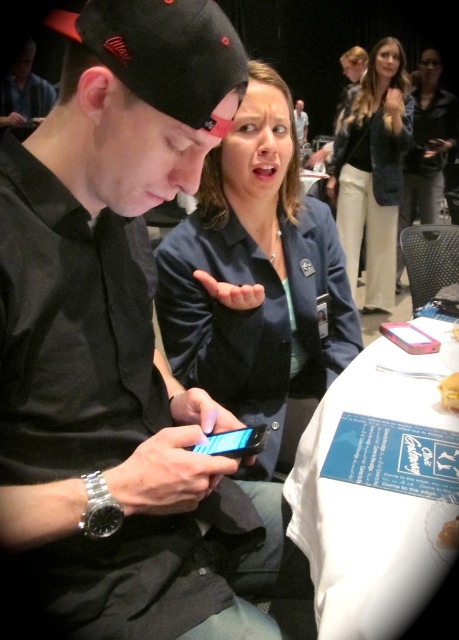
You are a tailor who needs to determine which garment requires more fabric for alterations. Based on the image, which item has a greater width between the dark blue blazer at upper right and the matte black shirt at center?

The dark blue blazer at upper right has a greater width than the matte black shirt at center, so it would require more fabric for alterations.

You are a fashion designer observing a couple at an event. You notice the dark blue blazer at upper right and the matte black shirt at center. Which clothing item would require more fabric to produce?

The dark blue blazer at upper right requires more fabric because it is larger in size than the matte black shirt at center.

You are a photographer trying to capture a candid shot of the scene. You need to decide whether the black matte phone at center will fit entirely within the frame if you focus on the dark blue blazer at upper right. Can you confirm if the phone will fit?

The black matte phone at center is shorter than the dark blue blazer at upper right, so it should fit within the frame when focusing on the blazer.